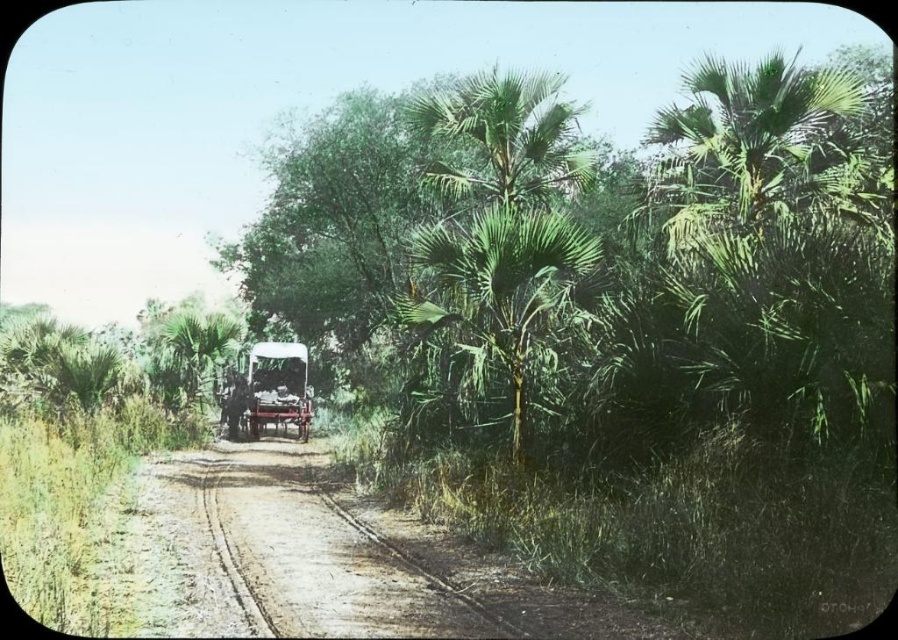
Who is taller, wooden cart at center or green leafy palm tree at center?

With more height is green leafy palm tree at center.

Does wooden cart at center have a lesser height compared to green leafy palm tree at center?

Correct, wooden cart at center is not as tall as green leafy palm tree at center.

Who is more forward, (280, 401) or (174, 365)?

Positioned in front is point (280, 401).

Find the location of `wooden cart at center`. wooden cart at center is located at coordinates (277, 387).

Which is in front, point (254, 502) or point (477, 220)?

Positioned in front is point (477, 220).

Who is higher up, brown dirt track at center or green leafy palm at center?

Positioned higher is green leafy palm at center.

Where is `brown dirt track at center`? brown dirt track at center is located at coordinates (327, 561).

At what (x,y) coordinates should I click in order to perform the action: click on brown dirt track at center. Please return your answer as a coordinate pair (x, y). The width and height of the screenshot is (898, 640). Looking at the image, I should click on (327, 561).

Can you confirm if brown dirt track at center is positioned to the right of green leafy palm tree at center?

Indeed, brown dirt track at center is positioned on the right side of green leafy palm tree at center.

Does point (217, 538) lie behind point (214, 326)?

No, it is in front of (214, 326).

Find the location of a particular element. brown dirt track at center is located at coordinates (327, 561).